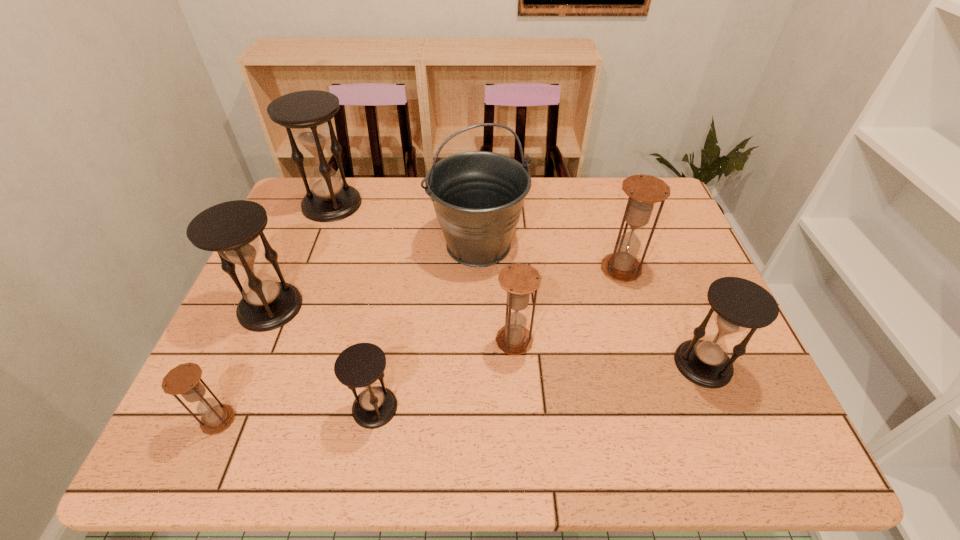
What are the coordinates of `the fourth hourglass from left to right` in the screenshot? It's located at (358, 366).

Find the location of `the smallest black hourglass`. the smallest black hourglass is located at coordinates (358, 366).

This screenshot has height=540, width=960. In order to click on the nearest brown hourglass in this screenshot , I will do `click(184, 379)`.

At what (x,y) coordinates should I click in order to perform the action: click on the smallest brown hourglass. Please return your answer as a coordinate pair (x, y). The image size is (960, 540). Looking at the image, I should click on (184, 379).

Identify the location of vacant space situated on the left of the gray bucket. (413, 245).

Locate an element on the screen. The image size is (960, 540). vacant space located 0.400m on the front of the biggest black hourglass is located at coordinates (284, 328).

Identify the location of free space located 0.060m on the front of the third smallest black hourglass. (251, 353).

Locate an element on the screen. vacant position located 0.160m on the right of the sixth nearest hourglass is located at coordinates (700, 269).

I want to click on vacant area located on the right of the third hourglass from right to left, so click(692, 341).

At what (x,y) coordinates should I click in order to perform the action: click on free spot located on the front of the rightmost hourglass. Please return your answer as a coordinate pair (x, y). Looking at the image, I should click on (742, 460).